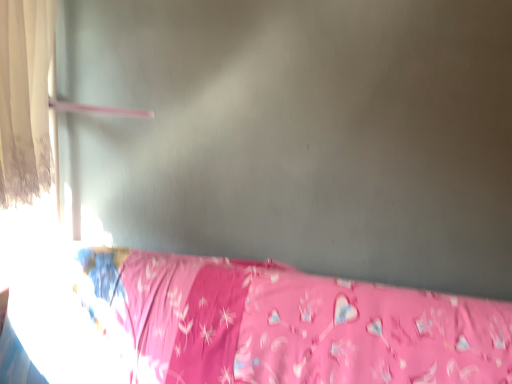
Question: From the image's perspective, is pink fabric bed at lower right located above or below white sheer curtain at left?

Choices:
 (A) below
 (B) above

Answer: (A)

Question: From a real-world perspective, is pink fabric bed at lower right positioned above or below white sheer curtain at left?

Choices:
 (A) below
 (B) above

Answer: (A)

Question: Do you think pink fabric bed at lower right is within white sheer curtain at left, or outside of it?

Choices:
 (A) outside
 (B) inside

Answer: (A)

Question: Considering the relative positions of white sheer curtain at left and pink fabric bed at lower right in the image provided, is white sheer curtain at left to the left or to the right of pink fabric bed at lower right?

Choices:
 (A) right
 (B) left

Answer: (B)

Question: Considering their positions, is white sheer curtain at left located in front of or behind pink fabric bed at lower right?

Choices:
 (A) behind
 (B) front

Answer: (A)

Question: Is white sheer curtain at left bigger or smaller than pink fabric bed at lower right?

Choices:
 (A) small
 (B) big

Answer: (A)

Question: Is point (38, 11) positioned closer to the camera than point (307, 365)?

Choices:
 (A) closer
 (B) farther

Answer: (B)